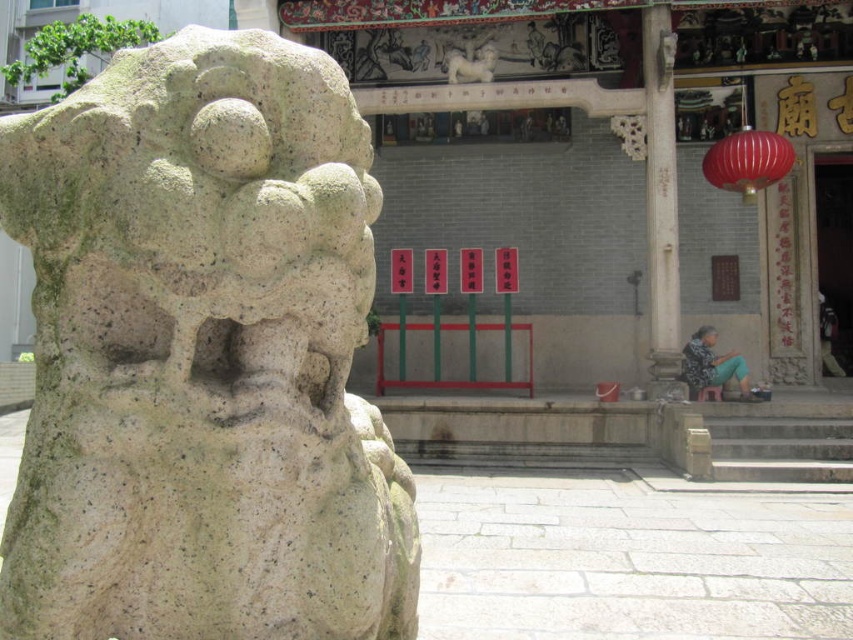
Find the location of a particular element. The height and width of the screenshot is (640, 853). granite stone lion at left is located at coordinates (202, 356).

Between point (136, 460) and point (659, 195), which one is positioned in front?

Point (136, 460) is in front.

This screenshot has height=640, width=853. I want to click on granite stone lion at left, so click(x=202, y=356).

Find the location of a particular element. This screenshot has height=640, width=853. granite stone lion at left is located at coordinates click(x=202, y=356).

Between granite stone lion at left and shiny red paper lantern at upper right, which one has more height?

granite stone lion at left

Which is more to the right, granite stone lion at left or shiny red paper lantern at upper right?

Positioned to the right is shiny red paper lantern at upper right.

Between point (172, 524) and point (715, 176), which one is positioned in front?

Point (172, 524)

Where is `granite stone lion at left`? This screenshot has width=853, height=640. granite stone lion at left is located at coordinates (202, 356).

Is point (654, 131) more distant than point (491, 65)?

No, (654, 131) is closer to viewer.

Which of these two, white stone pillar at upper right or white stone lion at upper center, stands shorter?

Standing shorter between the two is white stone lion at upper center.

Does point (643, 19) lie behind point (460, 54)?

No, it is in front of (460, 54).

At what (x,y) coordinates should I click in order to perform the action: click on white stone pillar at upper right. Please return your answer as a coordinate pair (x, y). Looking at the image, I should click on (660, 198).